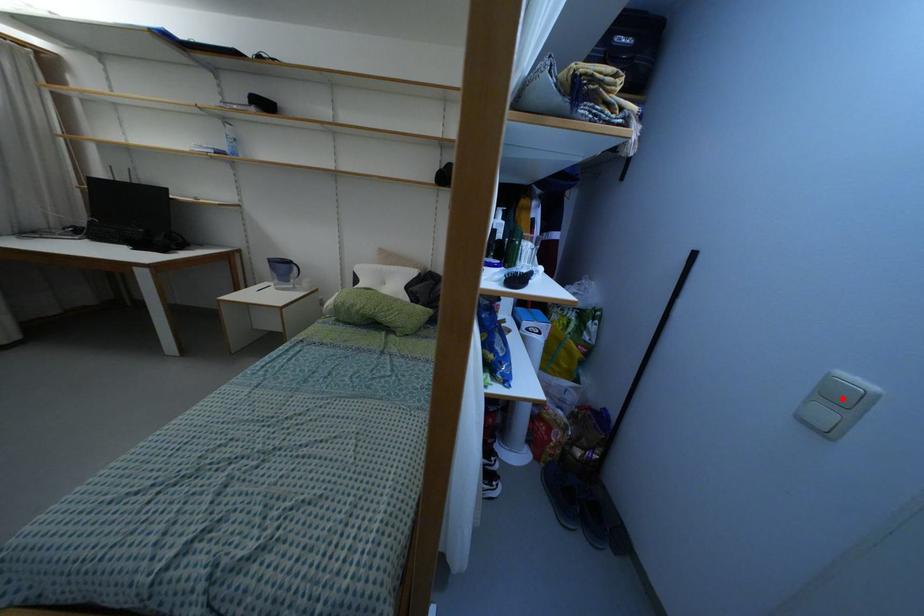
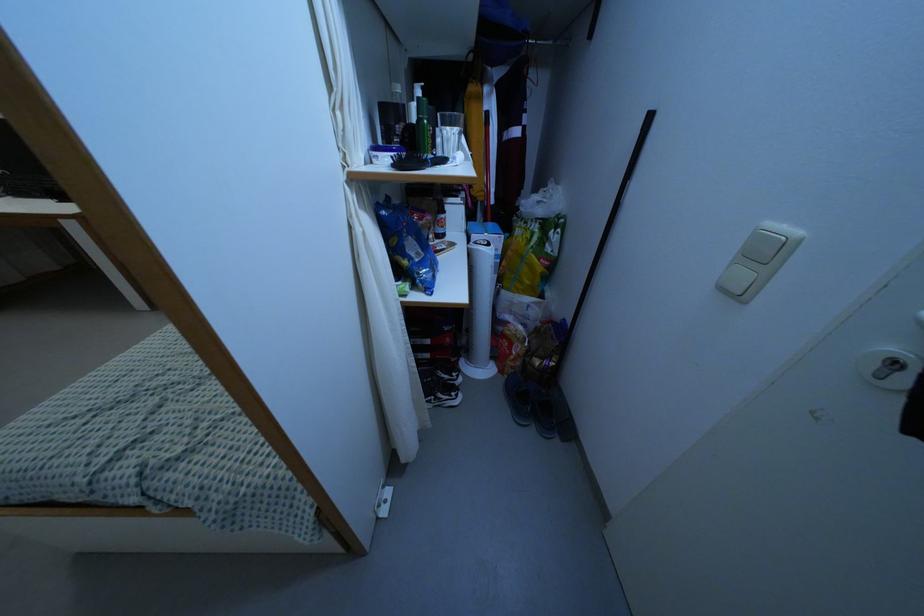
Where in the second image is the point corresponding to the highlighted location from the first image?

(762, 254)